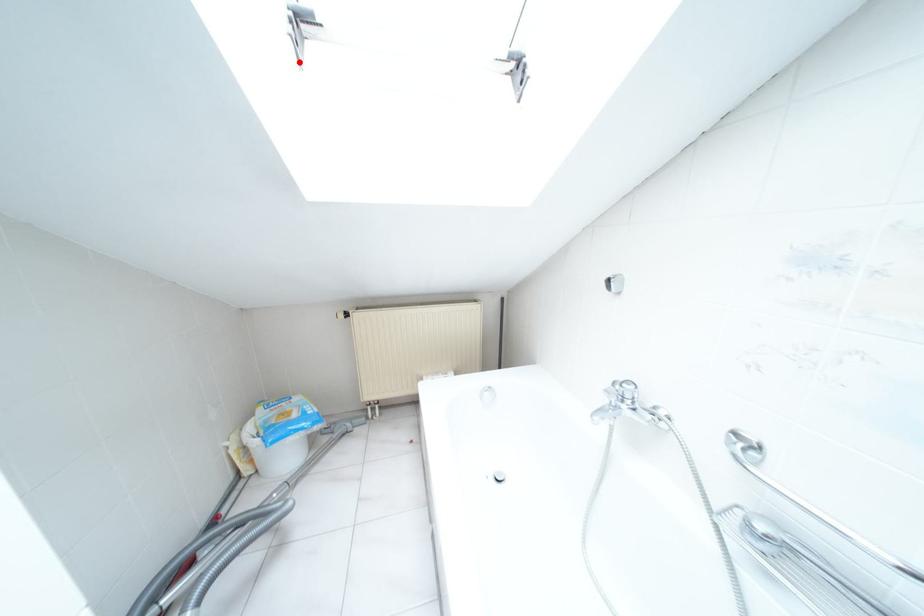
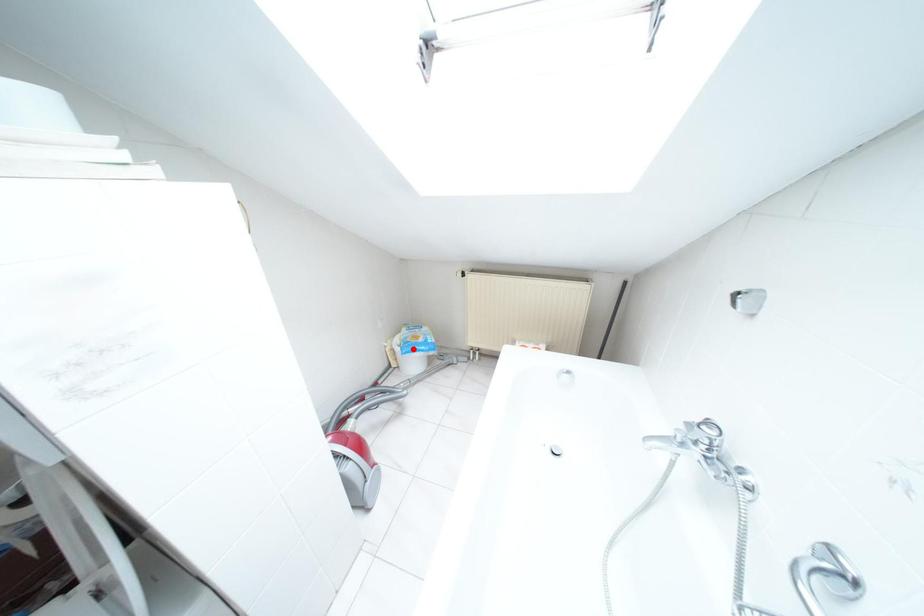
I am providing you with two images of the same scene from different viewpoints. A red point is marked on the first image and another point is marked on the second image. Is the marked point in image1 the same physical position as the marked point in image2?

No